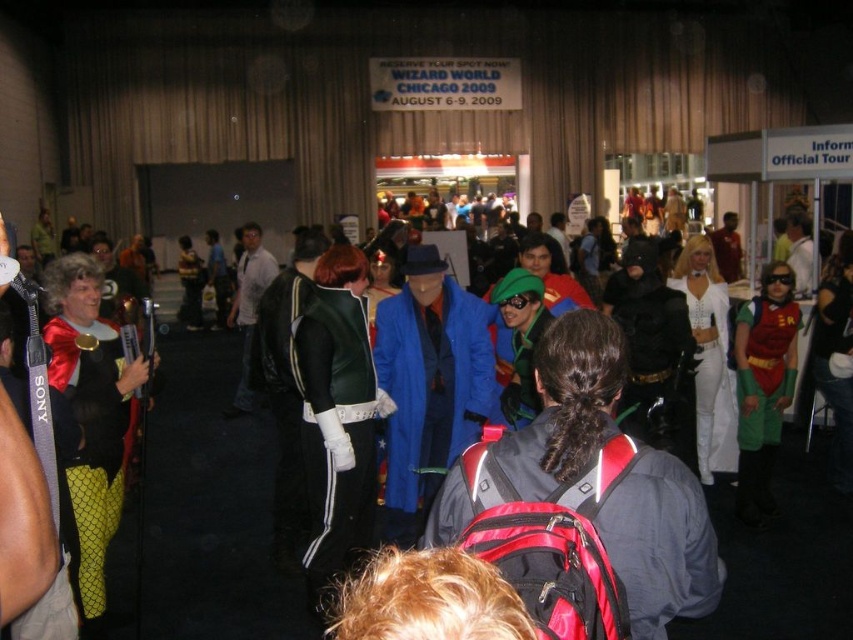
Is red synthetic backpack at center to the left of white leather pants at center from the viewer's perspective?

Indeed, red synthetic backpack at center is positioned on the left side of white leather pants at center.

Does red synthetic backpack at center have a larger size compared to white leather pants at center?

No.

Is point (663, 518) farther from camera compared to point (695, 356)?

No, (663, 518) is closer to viewer.

Identify the location of red synthetic backpack at center. This screenshot has height=640, width=853. (660, 544).

Can you confirm if green leather jacket at center is positioned to the left of blue fabric coat at center?

Yes, green leather jacket at center is to the left of blue fabric coat at center.

Between green leather jacket at center and blue fabric coat at center, which one appears on the right side from the viewer's perspective?

blue fabric coat at center is more to the right.

Between point (300, 360) and point (415, 342), which one is positioned in front?

Point (300, 360) is more forward.

You are a GUI agent. You are given a task and a screenshot of the screen. Output one action in this format:
    pyautogui.click(x=<x>, y=<y>)
    Task: Click on the green leather jacket at center
    
    Given the screenshot: What is the action you would take?
    pyautogui.click(x=335, y=428)

Which of these two, green fabric cape at center or red synthetic backpack at center, stands taller?

green fabric cape at center is taller.

What do you see at coordinates (210, 506) in the screenshot? I see `green fabric cape at center` at bounding box center [210, 506].

This screenshot has height=640, width=853. Identify the location of green fabric cape at center. (210, 506).

Locate an element on the screen. This screenshot has width=853, height=640. green fabric cape at center is located at coordinates (210, 506).